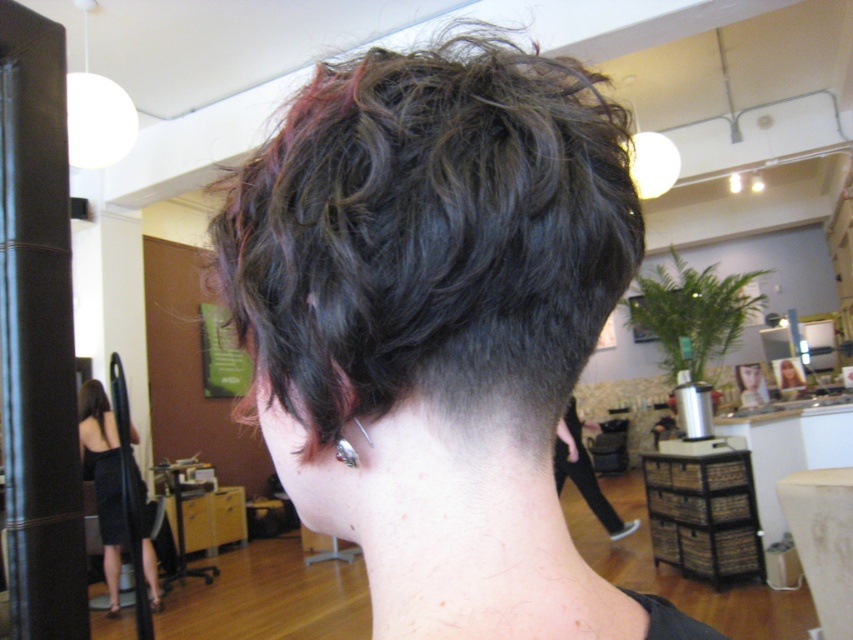
You are a tailor standing in a salon and need to adjust the length of the black dress at left. You are currently 1.7 meters tall. Can you reach the hem of the dress without a stool?

The black dress at left and viewer are 4.11 meters apart from each other, so the distance is too far for you to reach the hem of the black dress at left without a stool.

You are a customer in a salon and want to check if the point at coordinates point [90,442] is within your reach while standing at the entrance. The salon entrance is 15 feet away from the point. Can you reach it?

The distance of point [90,442] from viewer is 14.12 feet, which is less than the 15 feet distance from the entrance, so yes, you can reach it.